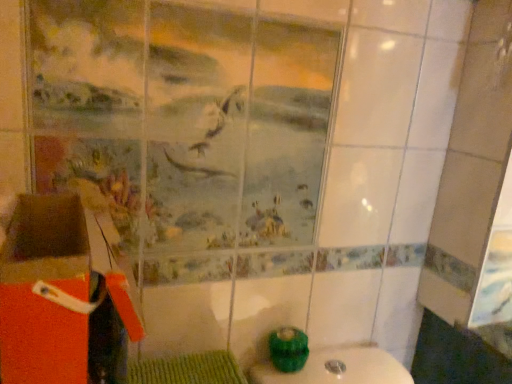
Locate an element on the screen. The image size is (512, 384). teal glossy toilet bowl at lower center is located at coordinates (288, 349).

Describe the element at coordinates (288, 349) in the screenshot. I see `teal glossy toilet bowl at lower center` at that location.

Measure the distance between point (57, 344) and camera.

Point (57, 344) is 51.50 centimeters away from camera.

At what (x,y) coordinates should I click in order to perform the action: click on orange cardboard box at lower left. Please return your answer as a coordinate pair (x, y). The width and height of the screenshot is (512, 384). Looking at the image, I should click on (61, 297).

Describe the element at coordinates (61, 297) in the screenshot. I see `orange cardboard box at lower left` at that location.

I want to click on teal glossy toilet bowl at lower center, so click(x=288, y=349).

Is orange cardboard box at lower left to the right of teal glossy toilet bowl at lower center from the viewer's perspective?

No, orange cardboard box at lower left is not to the right of teal glossy toilet bowl at lower center.

In the image, is orange cardboard box at lower left positioned in front of or behind teal glossy toilet bowl at lower center?

orange cardboard box at lower left is in front of teal glossy toilet bowl at lower center.

Which point is more forward, (29, 220) or (295, 368)?

The point (29, 220) is closer.

From the image's perspective, is orange cardboard box at lower left on top of teal glossy toilet bowl at lower center?

Yes.

From a real-world perspective, is orange cardboard box at lower left physically located above or below teal glossy toilet bowl at lower center?

From a real-world perspective, orange cardboard box at lower left is physically above teal glossy toilet bowl at lower center.

Considering the sizes of objects orange cardboard box at lower left and teal glossy toilet bowl at lower center in the image provided, who is thinner, orange cardboard box at lower left or teal glossy toilet bowl at lower center?

Thinner between the two is teal glossy toilet bowl at lower center.

Considering the relative sizes of orange cardboard box at lower left and teal glossy toilet bowl at lower center in the image provided, is orange cardboard box at lower left shorter than teal glossy toilet bowl at lower center?

No.

Can you confirm if orange cardboard box at lower left is smaller than teal glossy toilet bowl at lower center?

No.

Looking at this image, is teal glossy toilet bowl at lower center located within orange cardboard box at lower left?

Actually, teal glossy toilet bowl at lower center is outside orange cardboard box at lower left.

Is the surface of orange cardboard box at lower left in direct contact with teal glossy toilet bowl at lower center?

No, orange cardboard box at lower left is not next to teal glossy toilet bowl at lower center.

Is orange cardboard box at lower left turned away from teal glossy toilet bowl at lower center?

No, orange cardboard box at lower left's orientation is not away from teal glossy toilet bowl at lower center.

Can you tell me how much orange cardboard box at lower left and teal glossy toilet bowl at lower center differ in facing direction?

They differ by 5.88 degrees in their facing directions.

How much distance is there between orange cardboard box at lower left and teal glossy toilet bowl at lower center?

orange cardboard box at lower left and teal glossy toilet bowl at lower center are 21.19 inches apart.

You are a GUI agent. You are given a task and a screenshot of the screen. Output one action in this format:
    pyautogui.click(x=<x>, y=<y>)
    Task: Click on the teal below the orange cardboard box at lower left (from the image's perspective)
    Image resolution: width=512 pixels, height=384 pixels.
    Given the screenshot: What is the action you would take?
    pyautogui.click(x=288, y=349)

Between teal glossy toilet bowl at lower center and orange cardboard box at lower left, which one appears on the left side from the viewer's perspective?

From the viewer's perspective, orange cardboard box at lower left appears more on the left side.

Which is behind, teal glossy toilet bowl at lower center or orange cardboard box at lower left?

teal glossy toilet bowl at lower center is behind.

Which is farther, (303, 358) or (56, 243)?

The point (303, 358) is farther.

In the scene shown: From the image's perspective, is teal glossy toilet bowl at lower center above or below orange cardboard box at lower left?

From the image's perspective, teal glossy toilet bowl at lower center appears below orange cardboard box at lower left.

From a real-world perspective, relative to orange cardboard box at lower left, is teal glossy toilet bowl at lower center vertically above or below?

In terms of real-world spatial position, teal glossy toilet bowl at lower center is below orange cardboard box at lower left.

Considering the relative sizes of teal glossy toilet bowl at lower center and orange cardboard box at lower left in the image provided, is teal glossy toilet bowl at lower center wider than orange cardboard box at lower left?

No, teal glossy toilet bowl at lower center is not wider than orange cardboard box at lower left.

Considering the sizes of objects teal glossy toilet bowl at lower center and orange cardboard box at lower left in the image provided, who is taller, teal glossy toilet bowl at lower center or orange cardboard box at lower left?

orange cardboard box at lower left.

In terms of size, does teal glossy toilet bowl at lower center appear bigger or smaller than orange cardboard box at lower left?

Considering their sizes, teal glossy toilet bowl at lower center takes up less space than orange cardboard box at lower left.

In the scene shown: Which is correct: teal glossy toilet bowl at lower center is inside orange cardboard box at lower left, or outside of it?

teal glossy toilet bowl at lower center is outside orange cardboard box at lower left.

Is teal glossy toilet bowl at lower center not near orange cardboard box at lower left?

No, teal glossy toilet bowl at lower center is not far from orange cardboard box at lower left.

Is teal glossy toilet bowl at lower center facing away from orange cardboard box at lower left?

No.

How different are the orientations of teal glossy toilet bowl at lower center and orange cardboard box at lower left in degrees?

teal glossy toilet bowl at lower center and orange cardboard box at lower left are facing 5.88 degrees away from each other.

Where is `teal on the right of orange cardboard box at lower left`? This screenshot has height=384, width=512. teal on the right of orange cardboard box at lower left is located at coordinates (288, 349).

At what (x,y) coordinates should I click in order to perform the action: click on teal below the orange cardboard box at lower left (from a real-world perspective). Please return your answer as a coordinate pair (x, y). The image size is (512, 384). Looking at the image, I should click on (288, 349).

Locate an element on the screen. This screenshot has width=512, height=384. teal behind the orange cardboard box at lower left is located at coordinates (288, 349).